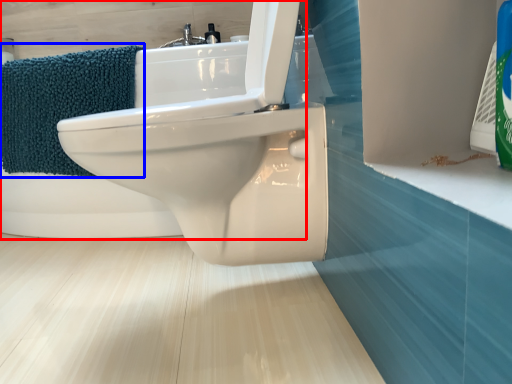
Question: Which point is further to the camera, bath (highlighted by a red box) or bath towel (highlighted by a blue box)?

Choices:
 (A) bath
 (B) bath towel

Answer: (B)